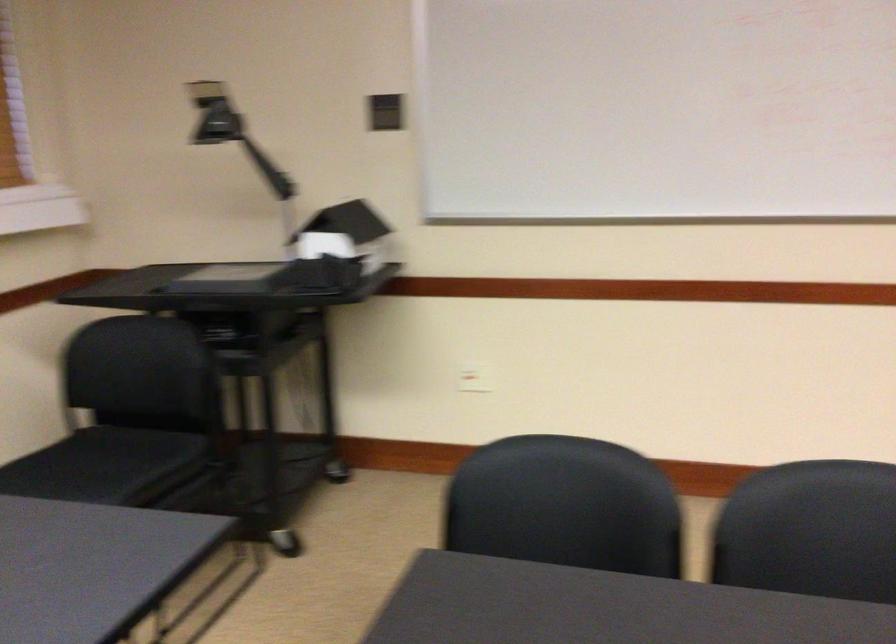
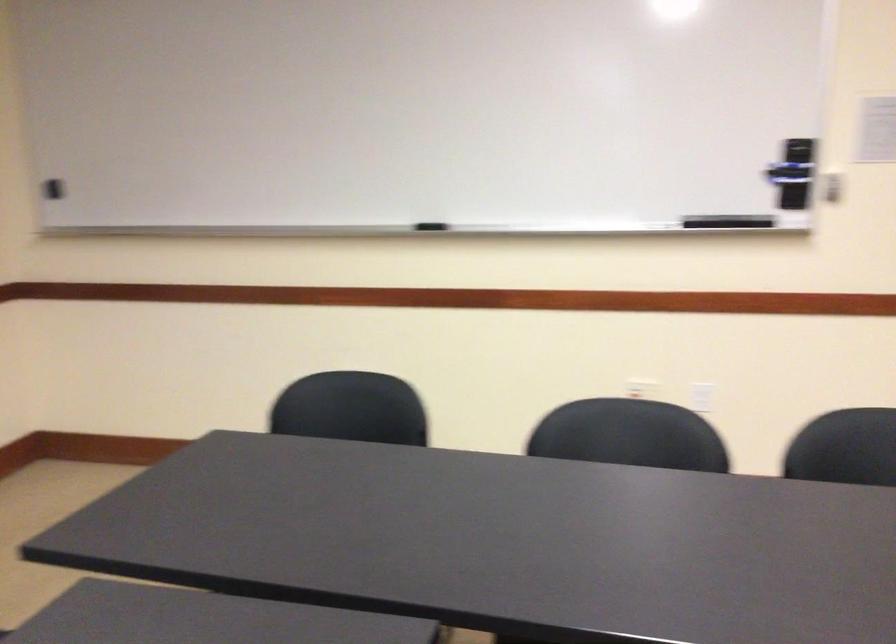
Question: The images are taken continuously from a first-person perspective. In which direction is your viewpoint rotating?

Choices:
 (A) Left
 (B) Right
 (C) Up
 (D) Down

Answer: (B)